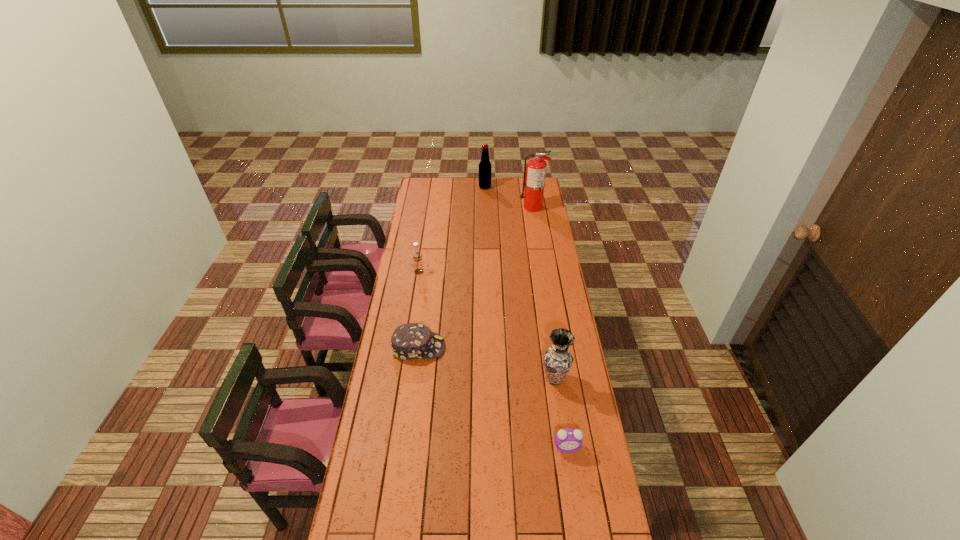
You are a GUI agent. You are given a task and a screenshot of the screen. Output one action in this format:
    pyautogui.click(x=<x>, y=<y>)
    Task: Click on the vacant space that satisfies the following two spatial constraints: 1. at the nozzle of the fire extinguisher; 2. on the face of the nearest object
    Image resolution: width=960 pixels, height=540 pixels.
    Given the screenshot: What is the action you would take?
    pyautogui.click(x=572, y=447)

This screenshot has width=960, height=540. I want to click on vacant space that satisfies the following two spatial constraints: 1. on the back side of the vase; 2. on the front-facing side of the fourth farthest object, so click(x=550, y=347).

You are a GUI agent. You are given a task and a screenshot of the screen. Output one action in this format:
    pyautogui.click(x=<x>, y=<y>)
    Task: Click on the vacant space that satisfies the following two spatial constraints: 1. on the front label of the vodka; 2. on the left side of the fifth farthest object
    This screenshot has width=960, height=540.
    Given the screenshot: What is the action you would take?
    pyautogui.click(x=402, y=379)

At what (x,y) coordinates should I click in order to perform the action: click on vacant space that satisfies the following two spatial constraints: 1. on the front label of the vase; 2. on the right side of the fourth tallest object. Please return your answer as a coordinate pair (x, y). This screenshot has height=540, width=960. Looking at the image, I should click on (402, 379).